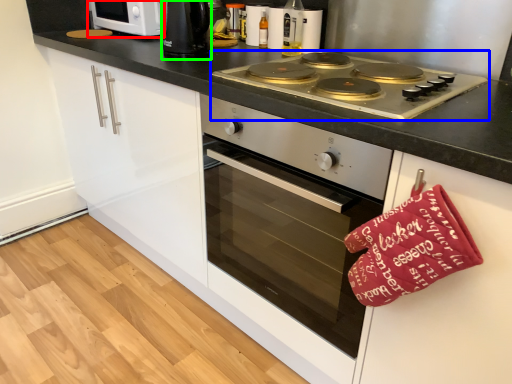
Question: Based on their relative distances, which object is nearer to home appliance (highlighted by a red box)? Choose from gas stove (highlighted by a blue box) and kitchen appliance (highlighted by a green box).

Choices:
 (A) gas stove
 (B) kitchen appliance

Answer: (B)